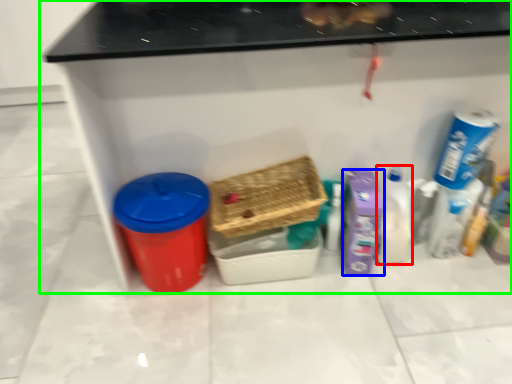
Question: Which object is positioned farthest from cleaning product (highlighted by a red box)? Select from cleaning product (highlighted by a blue box) and furniture (highlighted by a green box).

Choices:
 (A) cleaning product
 (B) furniture

Answer: (B)